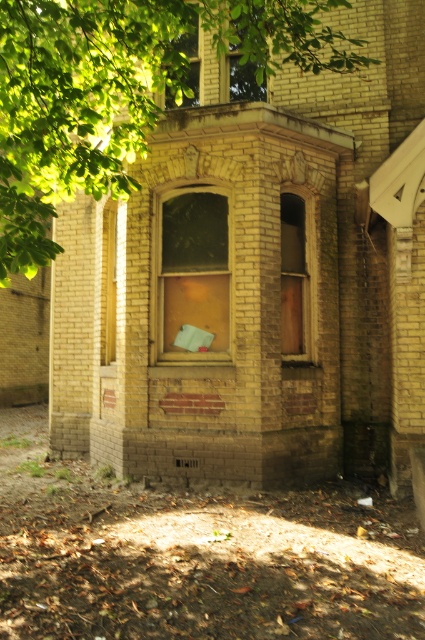
You are standing in front of a weathered brick building with a bay window. There are two points marked on the image at coordinates point (x=300, y=262) and point (x=181, y=97). Which of these points is closer to you?

Point (x=181, y=97) is closer to you because it is in front of point (x=300, y=262).

You are standing in front of the brick building and see a point marked at coordinates (192,275). Based on the scene description, where is this point located?

The point is located on the translucent glass window at center.